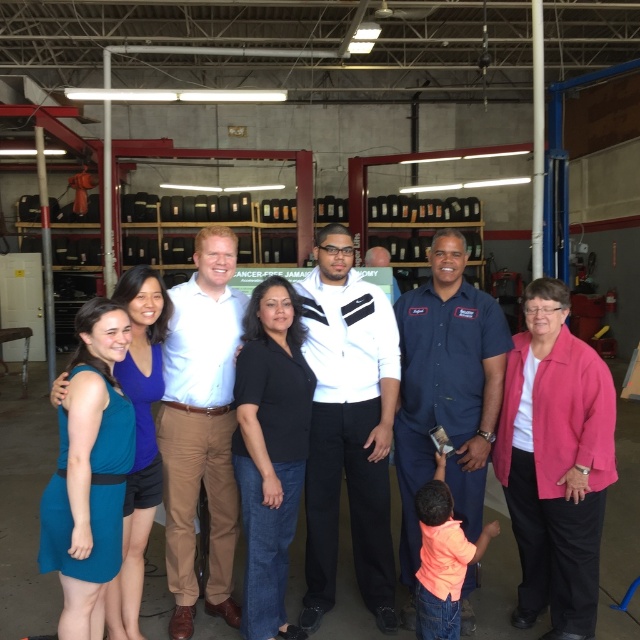
Is white smooth jacket at center closer to camera compared to blue uniform shirt at center?

That is False.

Identify the location of white smooth jacket at center. The image size is (640, 640). (348, 428).

Does brown cotton pants at center appear under teal fabric dress at lower left?

No, brown cotton pants at center is not below teal fabric dress at lower left.

Can you confirm if brown cotton pants at center is positioned above teal fabric dress at lower left?

Yes.

Is point (182, 307) positioned before point (532, 476)?

No, it is behind (532, 476).

You are a GUI agent. You are given a task and a screenshot of the screen. Output one action in this format:
    pyautogui.click(x=<x>, y=<y>)
    Task: Click on the brown cotton pants at center
    
    Given the screenshot: What is the action you would take?
    pyautogui.click(x=200, y=428)

Is point (426, 346) closer to camera compared to point (449, 467)?

No, it is behind (449, 467).

Does blue uniform shirt at center have a larger size compared to teal fabric dress at lower left?

No.

Measure the distance between blue uniform shirt at center and camera.

blue uniform shirt at center and camera are 10.27 feet apart from each other.

Locate an element on the screen. This screenshot has height=640, width=640. blue uniform shirt at center is located at coordinates (445, 388).